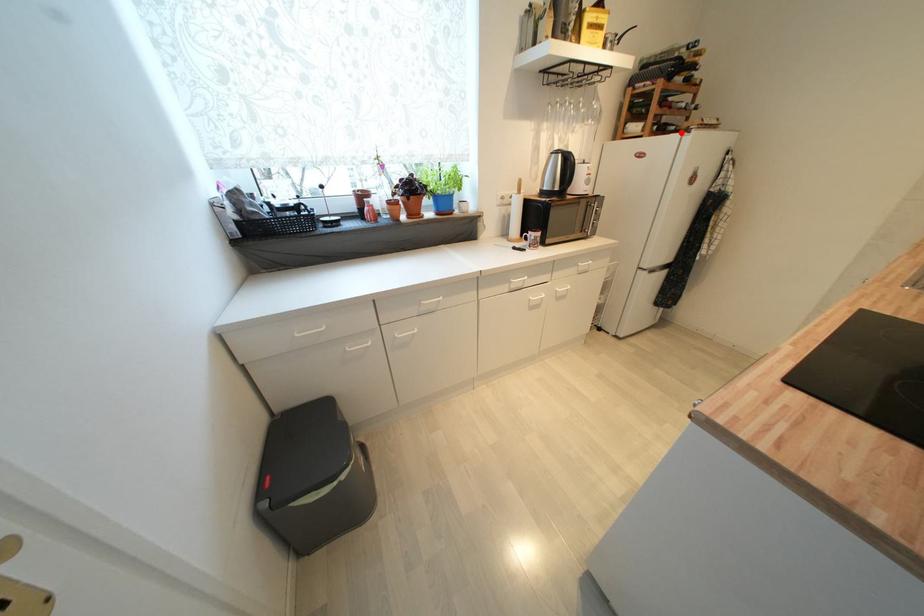
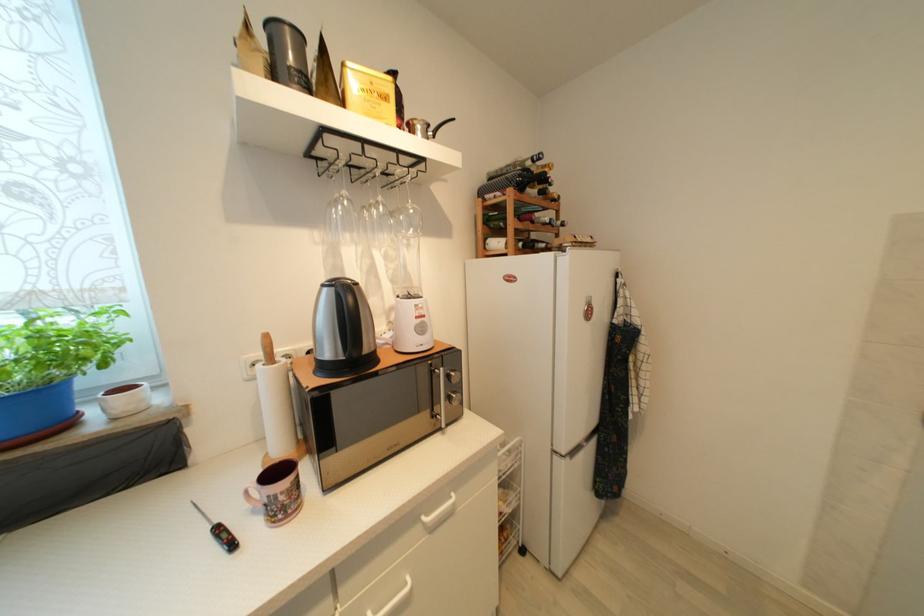
Locate, in the second image, the point that corresponds to the highlighted location in the first image.

(553, 251)